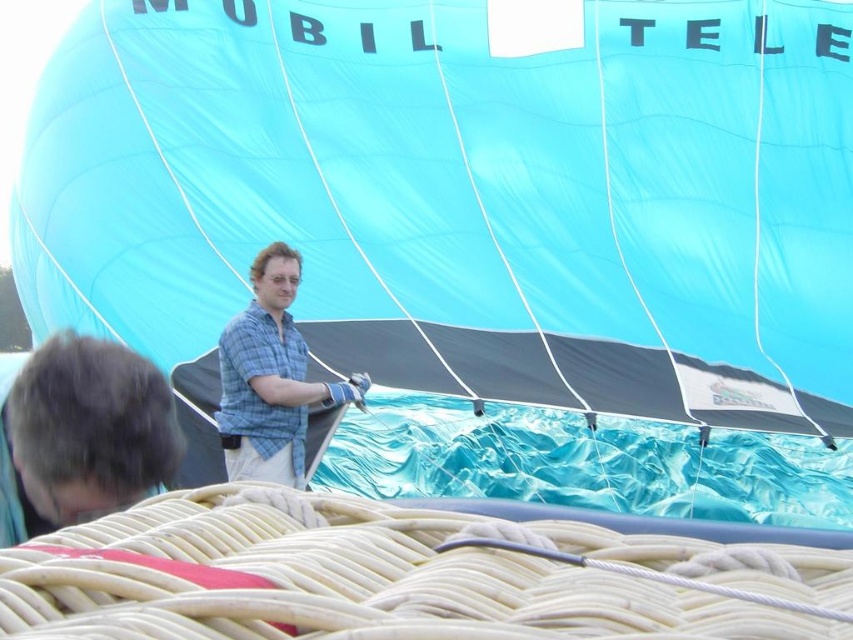
You are a visitor observing the hot air balloon preparation. You notice the blue glossy balloon at center and the blue plaid shirt at center. From your perspective, which object is positioned to the right?

The blue glossy balloon at center is to the right of the blue plaid shirt at center.

You are a safety inspector at the hot air balloon site. You need to ensure that the distance between the blue glossy balloon at center and the checkered fabric shirt at center is at least 6 meters to comply with safety regulations. Is the current distance compliant?

The distance between the blue glossy balloon at center and the checkered fabric shirt at center is 5.81 meters, which is less than the required 6 meters. Therefore, the current distance does not comply with safety regulations.